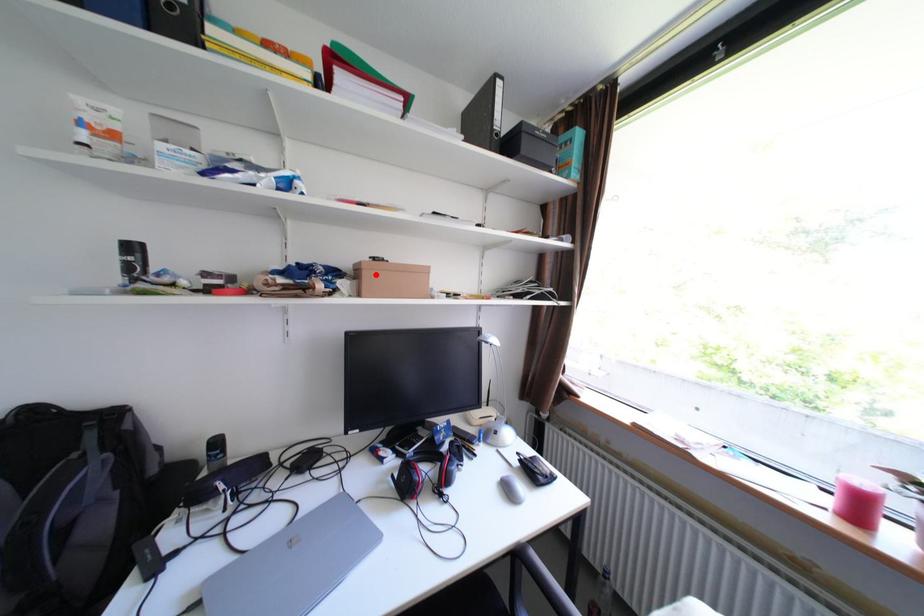
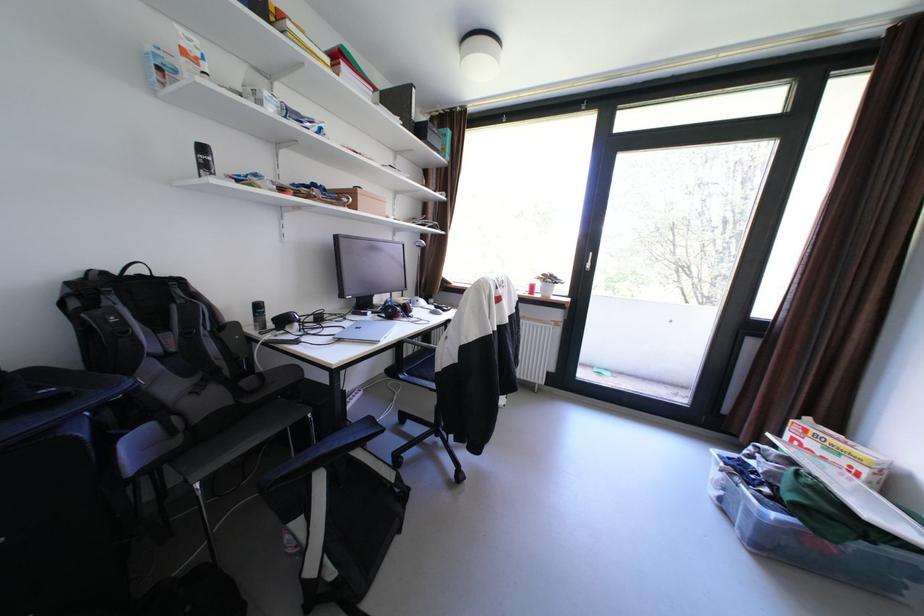
In the second image, find the point that corresponds to the highlighted location in the first image.

(370, 197)